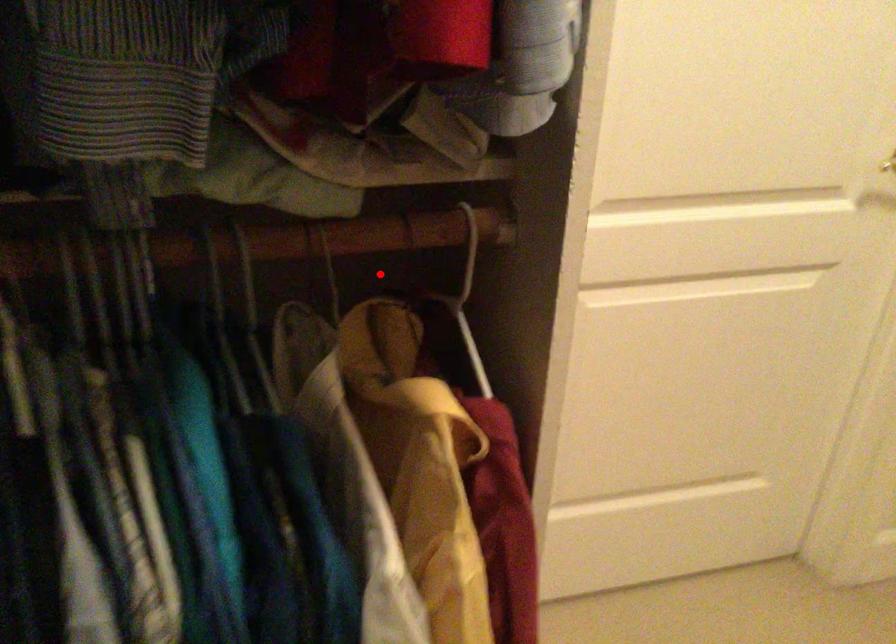
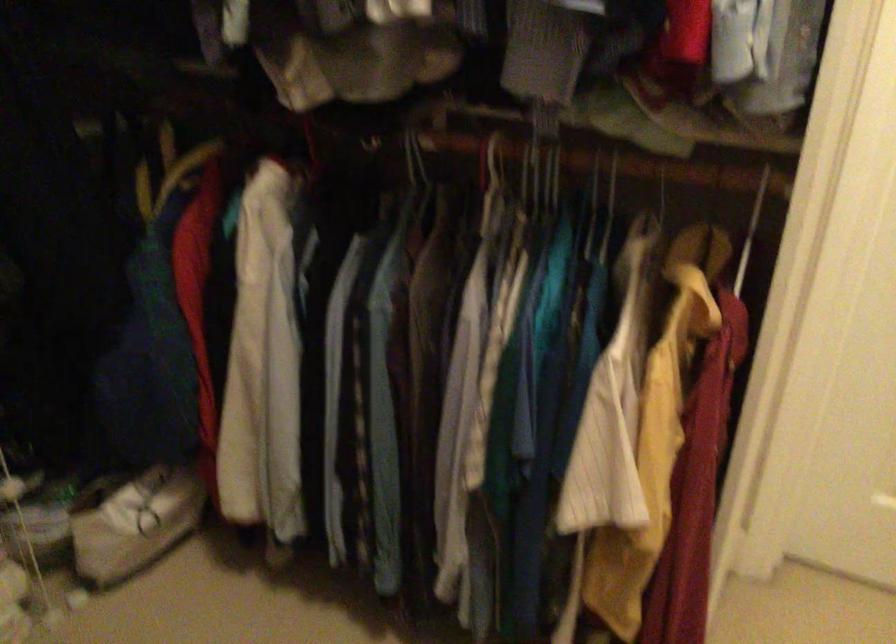
Question: A red point is marked in image1. In image2, is the corresponding 3D point closer to the camera or farther? Reply with the corresponding letter.

Choices:
 (A) The corresponding 3D point is closer.
 (B) The corresponding 3D point is farther.

Answer: (B)